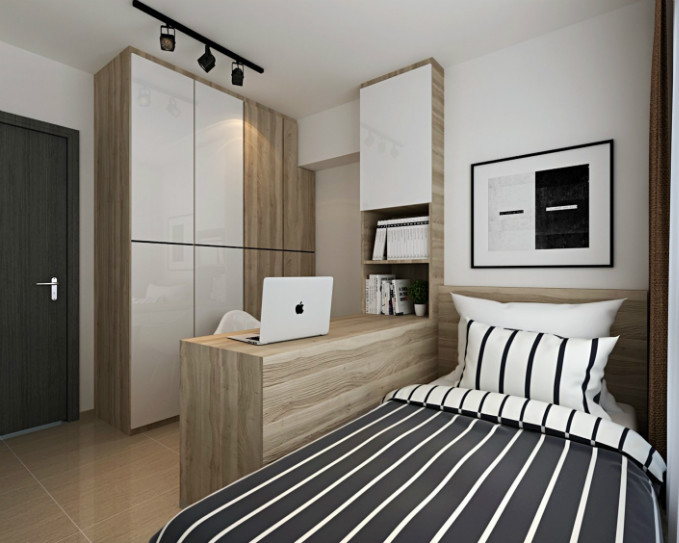
At what (x,y) coordinates should I click in order to perform the action: click on laptop. Please return your answer as a coordinate pair (x, y). Looking at the image, I should click on (276, 312).